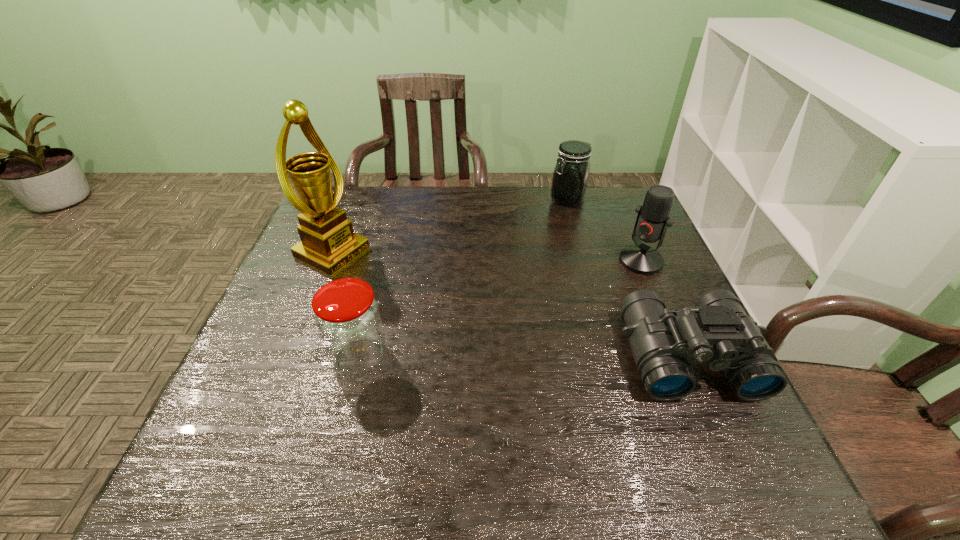
Identify the location of free spot between the microphone and the right jar. This screenshot has width=960, height=540. (604, 230).

Find the location of `free space between the award and the right jar`. free space between the award and the right jar is located at coordinates (450, 226).

Where is `free space between the microphone and the tallest object`? The width and height of the screenshot is (960, 540). free space between the microphone and the tallest object is located at coordinates (487, 257).

I want to click on free space between the farthest object and the left jar, so click(x=464, y=278).

Identify the location of unoccupied area between the farthest object and the second tallest object. The height and width of the screenshot is (540, 960). (604, 230).

I want to click on empty location between the binoculars and the tallest object, so click(x=510, y=305).

This screenshot has width=960, height=540. I want to click on vacant area that lies between the binoculars and the tallest object, so click(x=510, y=305).

This screenshot has width=960, height=540. In order to click on object that stands as the second closest to the binoculars in this screenshot , I will do `click(570, 177)`.

Locate an element on the screen. This screenshot has height=540, width=960. the fourth closest object to the tallest object is located at coordinates (653, 219).

Identify the location of vacant space that satisfies the following two spatial constraints: 1. on the back side of the farthest object; 2. on the right side of the nearer jar. The image size is (960, 540). (398, 199).